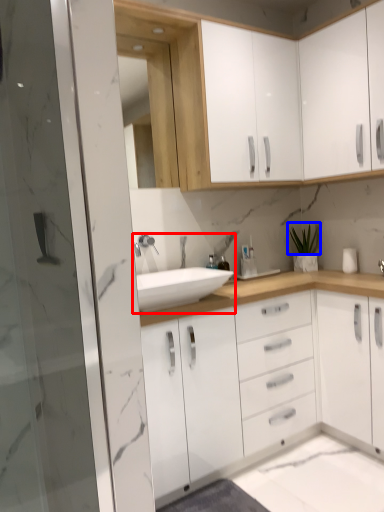
Question: Which object appears closest to the camera in this image, sink (highlighted by a red box) or plant (highlighted by a blue box)?

Choices:
 (A) sink
 (B) plant

Answer: (A)